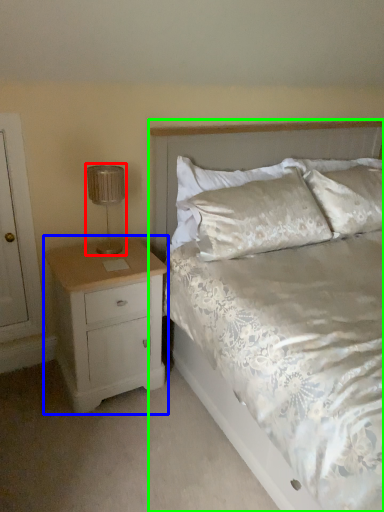
Question: Estimate the real-world distances between objects in this image. Which object is farther from lamp (highlighted by a red box), nightstand (highlighted by a blue box) or bed (highlighted by a green box)?

Choices:
 (A) nightstand
 (B) bed

Answer: (B)